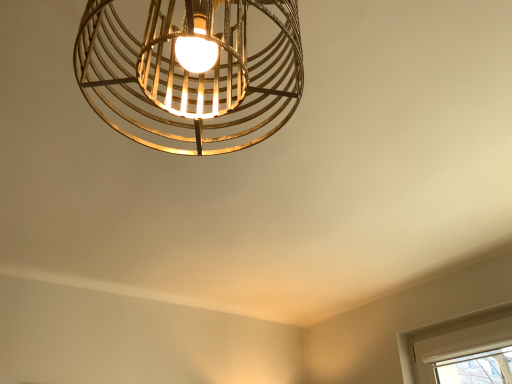
You are a GUI agent. You are given a task and a screenshot of the screen. Output one action in this format:
    pyautogui.click(x=<x>, y=<y>)
    Task: Click on the gold wire cage at upper center
    
    Given the screenshot: What is the action you would take?
    pyautogui.click(x=192, y=73)

What do you see at coordinates (192, 73) in the screenshot? This screenshot has width=512, height=384. I see `gold wire cage at upper center` at bounding box center [192, 73].

Image resolution: width=512 pixels, height=384 pixels. Find the location of `gold wire cage at upper center`. gold wire cage at upper center is located at coordinates (192, 73).